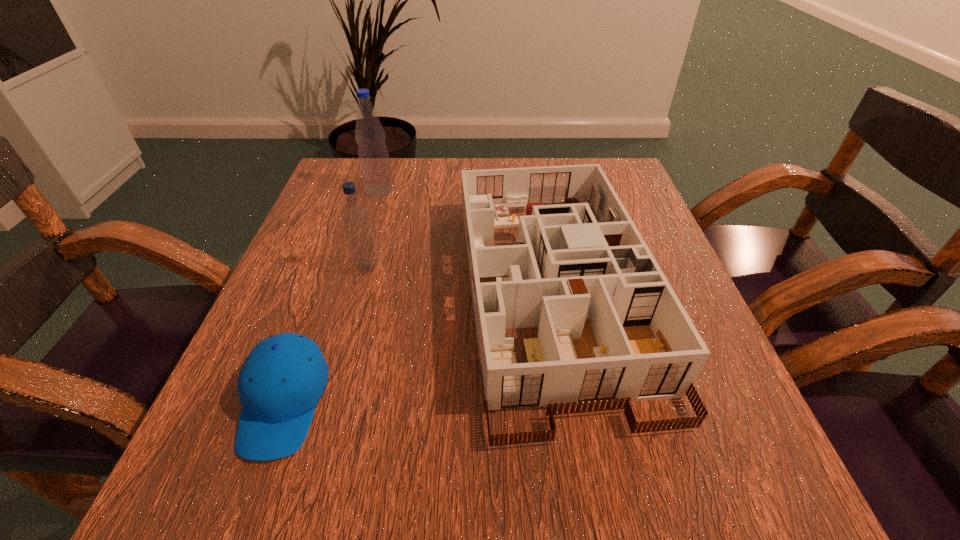
The width and height of the screenshot is (960, 540). In order to click on vacant point located between the farther water bottle and the nearer water bottle in this screenshot , I will do `click(373, 229)`.

This screenshot has width=960, height=540. Find the location of `vacant space that's between the nearer water bottle and the shortest object`. vacant space that's between the nearer water bottle and the shortest object is located at coordinates (325, 335).

Find the location of `free space that is in between the second tallest object and the dollhouse`. free space that is in between the second tallest object and the dollhouse is located at coordinates (460, 279).

Identify the location of vacant space that is in between the farther water bottle and the dollhouse. (466, 240).

Find the location of a particular element. free space between the tallest object and the rightmost object is located at coordinates (466, 240).

Image resolution: width=960 pixels, height=540 pixels. I want to click on unoccupied area between the second tallest object and the third tallest object, so click(460, 279).

Locate an element on the screen. This screenshot has width=960, height=540. free spot between the farther water bottle and the second shortest object is located at coordinates (466, 240).

Identify which object is located as the third nearest to the shorter water bottle. Please provide its 2D coordinates. Your answer should be formatted as a tuple, i.e. [(x, y)], where the tuple contains the x and y coordinates of a point satisfying the conditions above.

[(373, 155)]

Select which object is the closest to the shorter water bottle. Please provide its 2D coordinates. Your answer should be formatted as a tuple, i.e. [(x, y)], where the tuple contains the x and y coordinates of a point satisfying the conditions above.

[(612, 330)]

You are a GUI agent. You are given a task and a screenshot of the screen. Output one action in this format:
    pyautogui.click(x=<x>, y=<y>)
    Task: Click on the vacant position in the image that satisfies the following two spatial constraints: 1. on the front side of the dollhouse; 2. on the left side of the nearer water bottle
    The width and height of the screenshot is (960, 540).
    Given the screenshot: What is the action you would take?
    pyautogui.click(x=361, y=291)